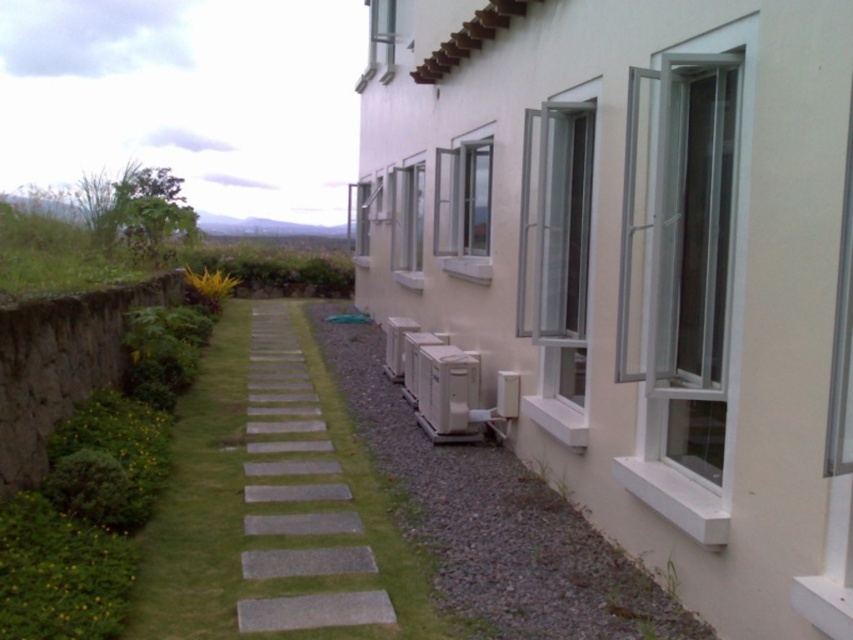
Is green grass at lower left wider than gray concrete path at center?

No, green grass at lower left is not wider than gray concrete path at center.

Is green grass at lower left further to camera compared to gray concrete path at center?

Yes, green grass at lower left is further from the viewer.

Between point (228, 429) and point (279, 317), which one is positioned behind?

The point (279, 317) is behind.

The height and width of the screenshot is (640, 853). Identify the location of green grass at lower left. (264, 512).